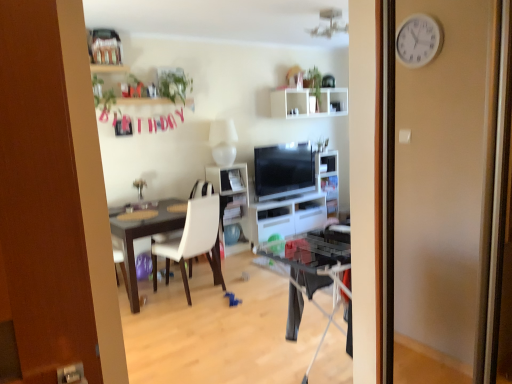
Question: Considering the relative positions of white glossy shelf at center, which ranks as the 2th shelf in back-to-front order, and white matte chair at center in the image provided, is white glossy shelf at center, which ranks as the 2th shelf in back-to-front order, in front of white matte chair at center?

Choices:
 (A) no
 (B) yes

Answer: (A)

Question: Does white glossy shelf at center, which is the first shelf from left to right, have a greater width compared to white matte chair at center?

Choices:
 (A) yes
 (B) no

Answer: (B)

Question: Is white glossy shelf at center, acting as the 1th shelf starting from the bottom, taller than white matte chair at center?

Choices:
 (A) yes
 (B) no

Answer: (A)

Question: Does white glossy shelf at center, positioned as the 1th shelf in front-to-back order, contain white matte chair at center?

Choices:
 (A) yes
 (B) no

Answer: (B)

Question: Is white glossy shelf at center, which is the first shelf from left to right, thinner than white matte chair at center?

Choices:
 (A) yes
 (B) no

Answer: (A)

Question: Can you confirm if white glossy shelf at center, which is the first shelf from left to right, is shorter than white matte chair at center?

Choices:
 (A) yes
 (B) no

Answer: (B)

Question: Does white glossy cabinet at center appear on the left side of matte black tv at center?

Choices:
 (A) no
 (B) yes

Answer: (B)

Question: Does white glossy cabinet at center have a greater height compared to matte black tv at center?

Choices:
 (A) yes
 (B) no

Answer: (B)

Question: From a real-world perspective, is white glossy cabinet at center physically above matte black tv at center?

Choices:
 (A) yes
 (B) no

Answer: (B)

Question: Can you confirm if white glossy cabinet at center is shorter than matte black tv at center?

Choices:
 (A) no
 (B) yes

Answer: (B)

Question: From a real-world perspective, is white glossy cabinet at center physically below matte black tv at center?

Choices:
 (A) yes
 (B) no

Answer: (A)

Question: Does white glossy cabinet at center lie in front of matte black tv at center?

Choices:
 (A) yes
 (B) no

Answer: (B)

Question: Is white matte shelf at upper center, marked as the 2th shelf in a bottom-to-top arrangement, positioned before matte black tv at center?

Choices:
 (A) no
 (B) yes

Answer: (A)